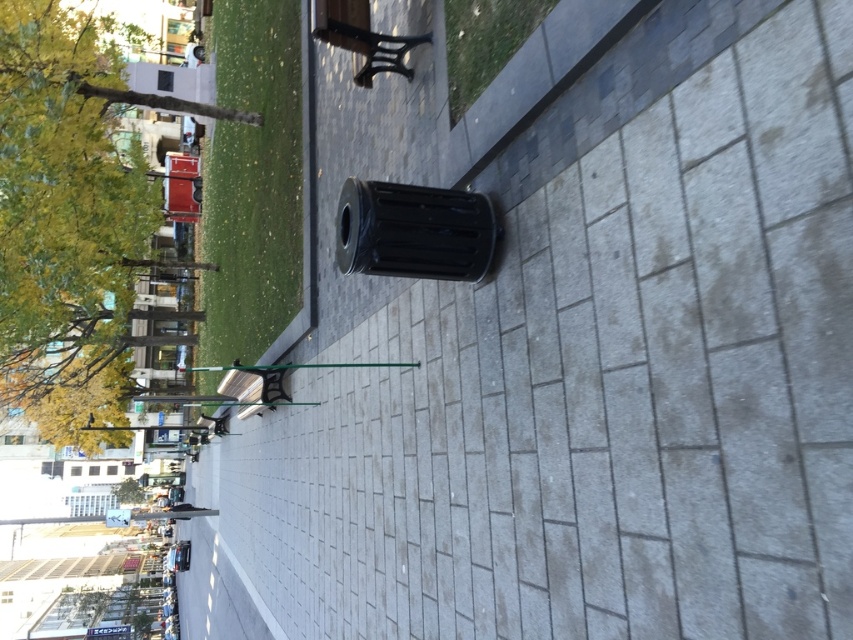
Who is more forward, (61, 72) or (134, 500)?

Point (61, 72) is more forward.

Between green leafy tree at upper left and green leafy tree at lower left, which one has less height?

green leafy tree at lower left

The width and height of the screenshot is (853, 640). What do you see at coordinates (68, 220) in the screenshot?
I see `green leafy tree at upper left` at bounding box center [68, 220].

Find the location of a particular element. green leafy tree at upper left is located at coordinates (68, 220).